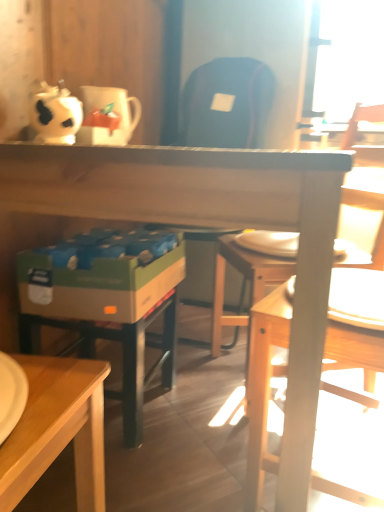
Question: Is wooden chair at right in front of or behind wooden desk at center in the image?

Choices:
 (A) front
 (B) behind

Answer: (B)

Question: Considering the positions of point (268, 390) and point (18, 159), is point (268, 390) closer or farther from the camera than point (18, 159)?

Choices:
 (A) farther
 (B) closer

Answer: (A)

Question: Which object is positioned closest to the wooden desk at center?

Choices:
 (A) wooden chair at right
 (B) white glossy coffee cup at upper left

Answer: (A)

Question: Estimate the real-world distances between objects in this image. Which object is closer to the wooden chair at right?

Choices:
 (A) white glossy coffee cup at upper left
 (B) wooden desk at center

Answer: (B)